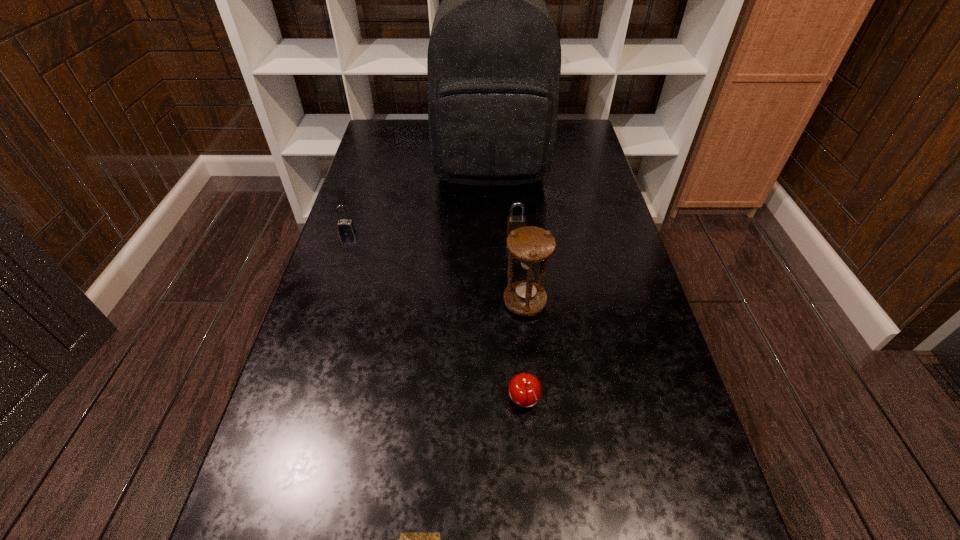
What are the coordinates of `vacant area that satisfies the following two spatial constraints: 1. on the back side of the rightmost padlock; 2. on the left side of the cherry` in the screenshot? It's located at (511, 232).

Find the location of `free space that satisfies the following two spatial constraints: 1. on the shackle of the hourglass; 2. on the left side of the leftmost object`. free space that satisfies the following two spatial constraints: 1. on the shackle of the hourglass; 2. on the left side of the leftmost object is located at coordinates (325, 302).

Locate an element on the screen. The width and height of the screenshot is (960, 540). free region that satisfies the following two spatial constraints: 1. on the front-facing side of the second nearest object; 2. on the left side of the farthest object is located at coordinates (498, 402).

In order to click on vacant region that satisfies the following two spatial constraints: 1. on the front-facing side of the tallest object; 2. on the left side of the rightmost padlock in this screenshot , I will do `click(492, 232)`.